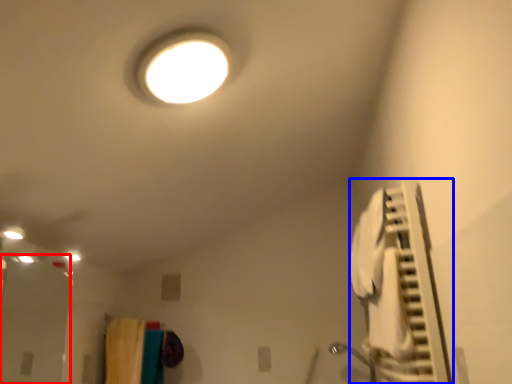
Question: Among these objects, which one is farthest to the camera, glass door (highlighted by a red box) or air conditioner (highlighted by a blue box)?

Choices:
 (A) glass door
 (B) air conditioner

Answer: (A)